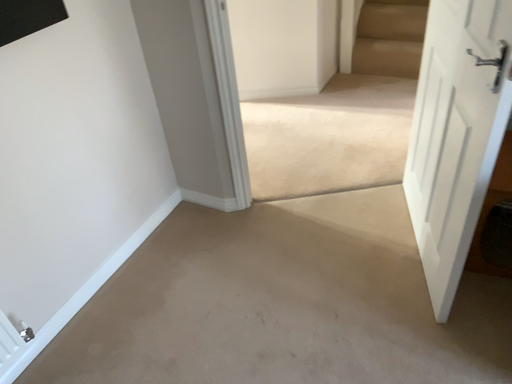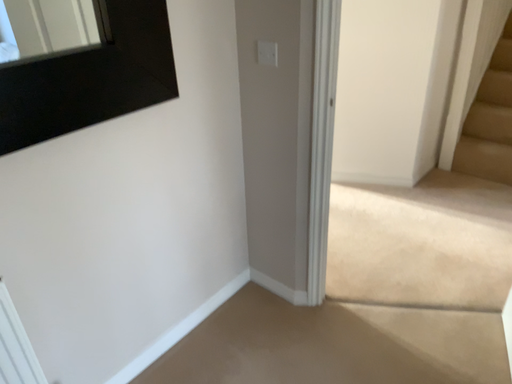
Question: Which way did the camera rotate in the video?

Choices:
 (A) rotated upward
 (B) rotated downward

Answer: (A)